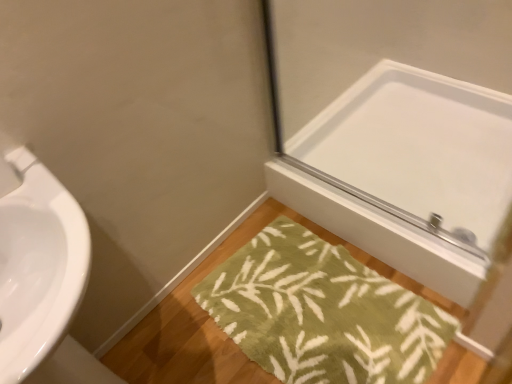
Question: From a real-world perspective, is green fuzzy bath mat at lower center physically above white glossy mirror at upper right?

Choices:
 (A) no
 (B) yes

Answer: (A)

Question: Is green fuzzy bath mat at lower center at the right side of white glossy mirror at upper right?

Choices:
 (A) no
 (B) yes

Answer: (A)

Question: Is green fuzzy bath mat at lower center outside of white glossy mirror at upper right?

Choices:
 (A) no
 (B) yes

Answer: (B)

Question: Are green fuzzy bath mat at lower center and white glossy mirror at upper right located far from each other?

Choices:
 (A) no
 (B) yes

Answer: (A)

Question: Is green fuzzy bath mat at lower center wider than white glossy mirror at upper right?

Choices:
 (A) yes
 (B) no

Answer: (B)

Question: Is green fuzzy bath mat at lower center closer to camera compared to white glossy mirror at upper right?

Choices:
 (A) yes
 (B) no

Answer: (A)

Question: Can green fuzzy bath mat at lower center be found inside white glossy mirror at upper right?

Choices:
 (A) yes
 (B) no

Answer: (B)

Question: Is white glossy mirror at upper right directly adjacent to green fuzzy bath mat at lower center?

Choices:
 (A) no
 (B) yes

Answer: (A)

Question: Is white glossy mirror at upper right turned away from green fuzzy bath mat at lower center?

Choices:
 (A) yes
 (B) no

Answer: (B)

Question: From the image's perspective, is white glossy mirror at upper right beneath green fuzzy bath mat at lower center?

Choices:
 (A) no
 (B) yes

Answer: (A)

Question: Is white glossy mirror at upper right wider than green fuzzy bath mat at lower center?

Choices:
 (A) yes
 (B) no

Answer: (A)

Question: Can you confirm if white glossy mirror at upper right is bigger than green fuzzy bath mat at lower center?

Choices:
 (A) yes
 (B) no

Answer: (A)

Question: From a real-world perspective, is white glossy mirror at upper right physically located above or below green fuzzy bath mat at lower center?

Choices:
 (A) above
 (B) below

Answer: (A)